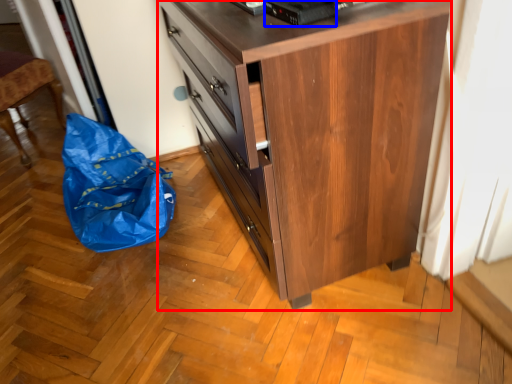
Question: Among these objects, which one is nearest to the camera, chest of drawers (highlighted by a red box) or appliance (highlighted by a blue box)?

Choices:
 (A) chest of drawers
 (B) appliance

Answer: (A)